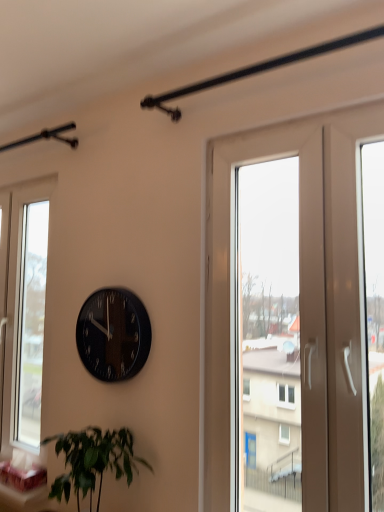
Question: Is transparent glass window at left smaller than green leafy plant at lower left?

Choices:
 (A) no
 (B) yes

Answer: (A)

Question: Is transparent glass window at left at the left side of green leafy plant at lower left?

Choices:
 (A) no
 (B) yes

Answer: (B)

Question: From the image's perspective, would you say transparent glass window at left is positioned over green leafy plant at lower left?

Choices:
 (A) yes
 (B) no

Answer: (A)

Question: From a real-world perspective, is transparent glass window at left located beneath green leafy plant at lower left?

Choices:
 (A) no
 (B) yes

Answer: (A)

Question: Is transparent glass window at left wider than green leafy plant at lower left?

Choices:
 (A) yes
 (B) no

Answer: (B)

Question: Considering the positions of white glossy screen door at right and green leafy plant at lower left in the image, is white glossy screen door at right bigger or smaller than green leafy plant at lower left?

Choices:
 (A) big
 (B) small

Answer: (A)

Question: In the image, is white glossy screen door at right on the left side or the right side of green leafy plant at lower left?

Choices:
 (A) right
 (B) left

Answer: (A)

Question: In terms of width, does white glossy screen door at right look wider or thinner when compared to green leafy plant at lower left?

Choices:
 (A) wide
 (B) thin

Answer: (B)

Question: Considering their positions, is white glossy screen door at right located in front of or behind green leafy plant at lower left?

Choices:
 (A) front
 (B) behind

Answer: (A)

Question: From a real-world perspective, is transparent glass window at left physically located above or below green leafy plant at lower left?

Choices:
 (A) below
 (B) above

Answer: (B)

Question: Based on their positions, is transparent glass window at left located to the left or right of green leafy plant at lower left?

Choices:
 (A) right
 (B) left

Answer: (B)

Question: From the image's perspective, is transparent glass window at left above or below green leafy plant at lower left?

Choices:
 (A) above
 (B) below

Answer: (A)

Question: Which is correct: transparent glass window at left is inside green leafy plant at lower left, or outside of it?

Choices:
 (A) inside
 (B) outside

Answer: (B)

Question: Is green leafy plant at lower left inside or outside of white glossy screen door at right?

Choices:
 (A) inside
 (B) outside

Answer: (B)

Question: From their relative heights in the image, would you say green leafy plant at lower left is taller or shorter than white glossy screen door at right?

Choices:
 (A) tall
 (B) short

Answer: (B)